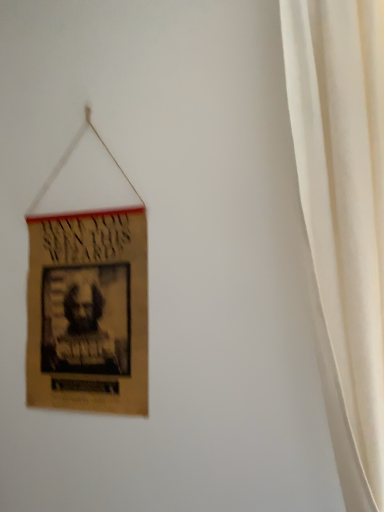
I want to click on brown cardboard poster at left, so click(88, 312).

The width and height of the screenshot is (384, 512). What do you see at coordinates (88, 312) in the screenshot?
I see `brown cardboard poster at left` at bounding box center [88, 312].

You are a GUI agent. You are given a task and a screenshot of the screen. Output one action in this format:
    pyautogui.click(x=<x>, y=<y>)
    Task: Click on the brown cardboard poster at left
    The height and width of the screenshot is (512, 384).
    Given the screenshot: What is the action you would take?
    pyautogui.click(x=88, y=312)